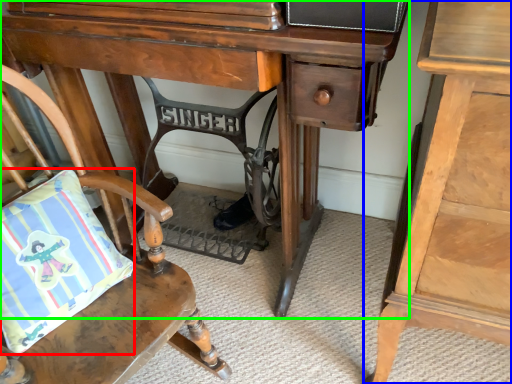
Question: Based on their relative distances, which object is nearer to pillow (highlighted by a red box)? Choose from nightstand (highlighted by a blue box) and desk (highlighted by a green box).

Choices:
 (A) nightstand
 (B) desk

Answer: (B)